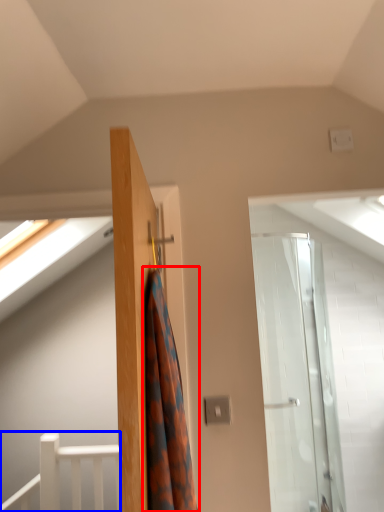
Question: Which point is closer to the camera, shower curtain (highlighted by a red box) or rail (highlighted by a blue box)?

Choices:
 (A) shower curtain
 (B) rail

Answer: (A)